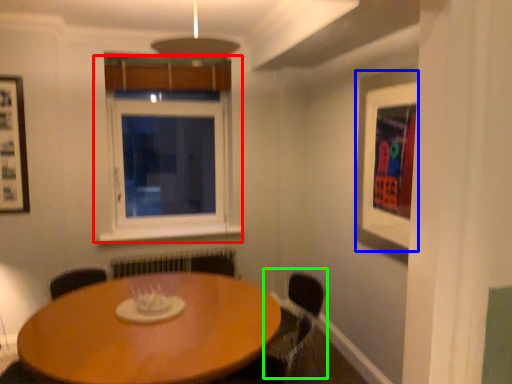
Question: Estimate the real-world distances between objects in this image. Which object is farther from window (highlighted by a red box), picture frame (highlighted by a blue box) or armchair (highlighted by a green box)?

Choices:
 (A) picture frame
 (B) armchair

Answer: (A)